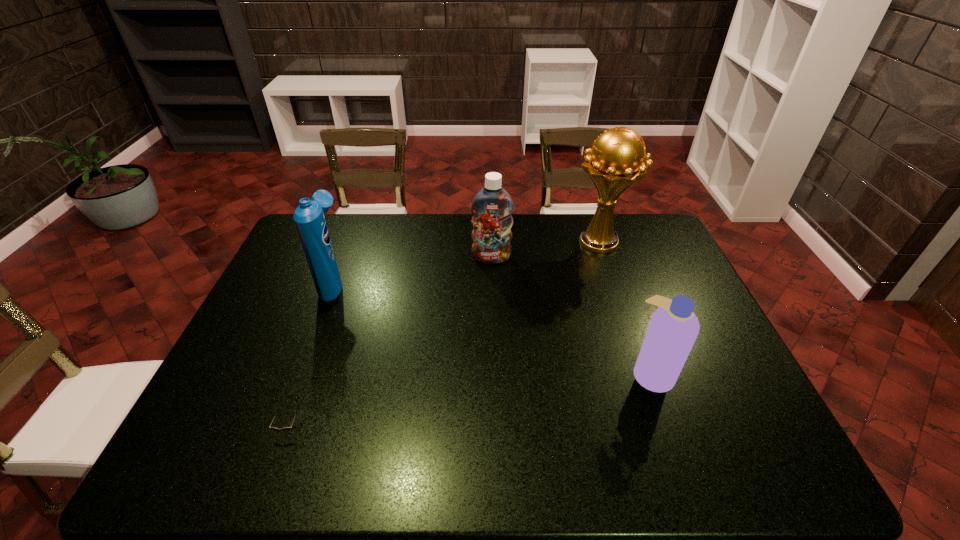
Where is `free area in between the trophy_cup and the second shampoo from right to left`? This screenshot has height=540, width=960. free area in between the trophy_cup and the second shampoo from right to left is located at coordinates (545, 251).

This screenshot has height=540, width=960. Identify the location of unoccupied position between the third object from left to right and the trophy_cup. (545, 251).

Image resolution: width=960 pixels, height=540 pixels. I want to click on vacant area that lies between the tallest object and the sunglasses, so click(444, 336).

Select which object is the closest to the shortest object. Please provide its 2D coordinates. Your answer should be formatted as a tuple, i.e. [(x, y)], where the tuple contains the x and y coordinates of a point satisfying the conditions above.

[(309, 218)]

This screenshot has width=960, height=540. Find the location of `object that can be found as the closest to the trophy_cup`. object that can be found as the closest to the trophy_cup is located at coordinates (492, 207).

At what (x,y) coordinates should I click in order to perform the action: click on the second closest shampoo to the second shampoo from left to right. Please return your answer as a coordinate pair (x, y). The image size is (960, 540). Looking at the image, I should click on (673, 329).

At what (x,y) coordinates should I click in order to perform the action: click on the closest shampoo to the second shampoo from right to left. Please return your answer as a coordinate pair (x, y). This screenshot has height=540, width=960. Looking at the image, I should click on (309, 218).

Find the location of `free space that satisfies the following two spatial constraints: 1. on the front side of the rightmost shampoo; 2. on the right side of the leftmost shampoo`. free space that satisfies the following two spatial constraints: 1. on the front side of the rightmost shampoo; 2. on the right side of the leftmost shampoo is located at coordinates (300, 373).